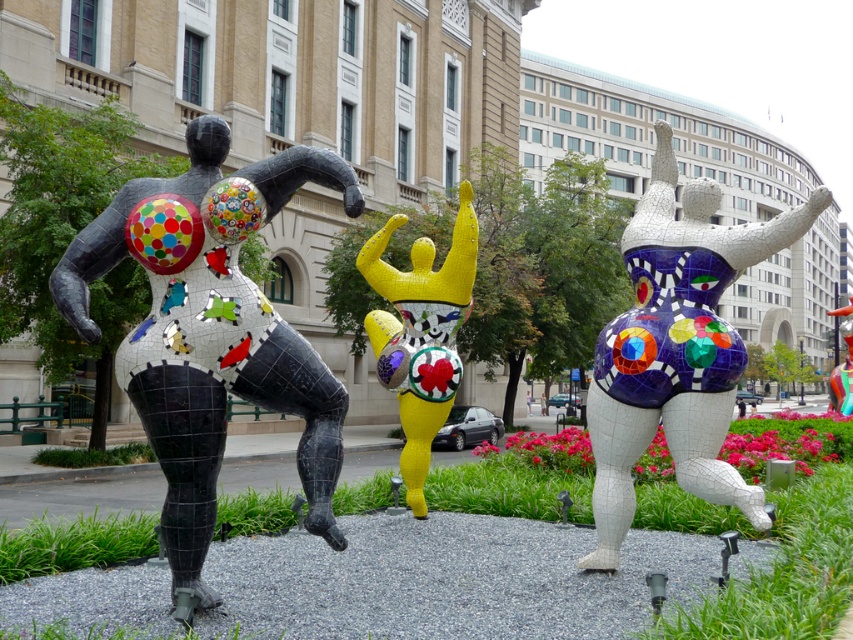
Does point (339, 161) lie behind point (408, 368)?

No, (339, 161) is closer to viewer.

Which is behind, point (90, 330) or point (471, 195)?

Point (471, 195)

You are a GUI agent. You are given a task and a screenshot of the screen. Output one action in this format:
    pyautogui.click(x=<x>, y=<y>)
    Task: Click on the black mosaic figure at left
    Image resolution: width=853 pixels, height=640 pixels.
    Given the screenshot: What is the action you would take?
    pyautogui.click(x=212, y=330)

Is crackle-glazed ceramic sculpture at center closer to camera compared to shiny yellow mosaic figure at center?

Yes, it is in front of shiny yellow mosaic figure at center.

Is the position of crackle-glazed ceramic sculpture at center more distant than that of shiny yellow mosaic figure at center?

No.

Between point (686, 410) and point (456, 362), which one is positioned in front?

Point (686, 410) is in front.

Find the location of `crackle-glazed ceramic sculpture at center`. crackle-glazed ceramic sculpture at center is located at coordinates (676, 348).

Does black mosaic figure at left come behind crackle-glazed ceramic sculpture at center?

No, it is in front of crackle-glazed ceramic sculpture at center.

Between point (151, 224) and point (602, 365), which one is positioned behind?

The point (602, 365) is behind.

Locate an element on the screen. black mosaic figure at left is located at coordinates (212, 330).